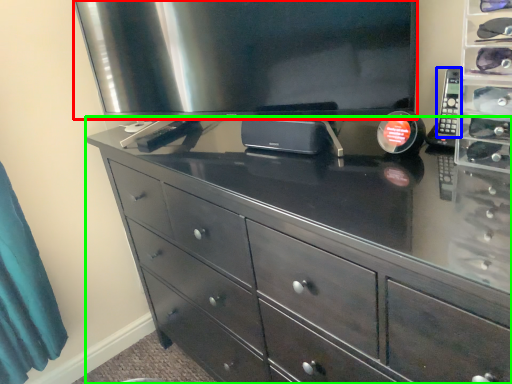
Question: Which object is positioned farthest from television (highlighted by a red box)? Select from control (highlighted by a blue box) and chest of drawers (highlighted by a green box).

Choices:
 (A) control
 (B) chest of drawers

Answer: (A)